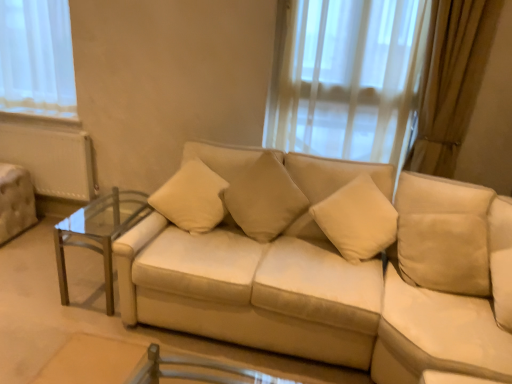
Question: Based on their sizes in the image, would you say beige suede swivel chair at right is bigger or smaller than beige suede couch at center?

Choices:
 (A) big
 (B) small

Answer: (B)

Question: Considering the positions of beige suede swivel chair at right and beige suede couch at center in the image, is beige suede swivel chair at right taller or shorter than beige suede couch at center?

Choices:
 (A) short
 (B) tall

Answer: (A)

Question: Which object is positioned farthest from the clear glass table at left?

Choices:
 (A) beige fabric pillow at center, placed as the 1th pillow when sorted from right to left
 (B) beige fabric pillow at center, the 2th pillow in the right-to-left sequence
 (C) beige suede couch at center
 (D) beige suede swivel chair at right

Answer: (D)

Question: Estimate the real-world distances between objects in this image. Which object is closer to the clear glass table at left?

Choices:
 (A) beige fabric pillow at center, the 2th pillow in the right-to-left sequence
 (B) beige fabric pillow at center, marked as the 2th pillow in a left-to-right arrangement
 (C) beige suede swivel chair at right
 (D) beige suede couch at center

Answer: (A)